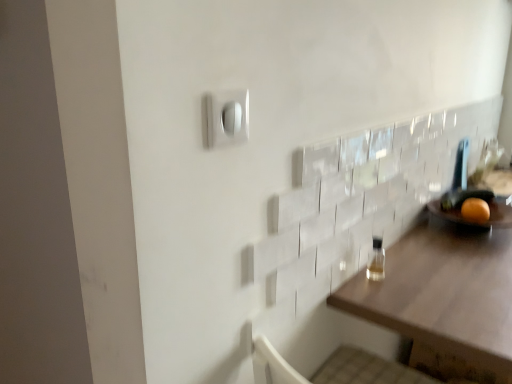
Based on the photo, measure the distance between point (243, 103) and camera.

26.02 inches.

This screenshot has height=384, width=512. What do you see at coordinates (376, 260) in the screenshot? I see `clear glass bottle at right` at bounding box center [376, 260].

What do you see at coordinates (444, 297) in the screenshot? I see `brown wooden table at right` at bounding box center [444, 297].

The image size is (512, 384). I want to click on white plastic light switch at upper center, so click(227, 117).

In the image, is white plastic light switch at upper center on the left side or the right side of clear glass bottle at right?

From the image, it's evident that white plastic light switch at upper center is to the left of clear glass bottle at right.

At what (x,y) coordinates should I click in order to perform the action: click on light switch above the clear glass bottle at right (from the image's perspective). Please return your answer as a coordinate pair (x, y). Image resolution: width=512 pixels, height=384 pixels. Looking at the image, I should click on (227, 117).

In terms of size, does white plastic light switch at upper center appear bigger or smaller than clear glass bottle at right?

white plastic light switch at upper center is smaller than clear glass bottle at right.

Is point (244, 120) positioned after point (368, 258)?

That is False.

Which object is thinner, orange matte at right or white plastic light switch at upper center?

white plastic light switch at upper center is thinner.

Considering their positions, is orange matte at right located in front of or behind white plastic light switch at upper center?

orange matte at right is behind white plastic light switch at upper center.

In terms of height, does orange matte at right look taller or shorter compared to white plastic light switch at upper center?

Considering their sizes, orange matte at right has less height than white plastic light switch at upper center.

Which object is positioned more to the left, orange matte at right or white plastic light switch at upper center?

white plastic light switch at upper center.

Does white plastic light switch at upper center have a smaller size compared to brown wooden table at right?

Indeed, white plastic light switch at upper center has a smaller size compared to brown wooden table at right.

Which point is more distant from viewer, (208, 145) or (465, 351)?

The point (465, 351) is farther from the camera.

Which is in front, white plastic light switch at upper center or brown wooden table at right?

white plastic light switch at upper center is more forward.

From the image's perspective, which is below, white plastic light switch at upper center or brown wooden table at right?

brown wooden table at right is shown below in the image.

From a real-world perspective, does brown wooden table at right sit lower than white plastic light switch at upper center?

Correct, in the physical world, brown wooden table at right is lower than white plastic light switch at upper center.

Considering the relative sizes of brown wooden table at right and white plastic light switch at upper center in the image provided, is brown wooden table at right thinner than white plastic light switch at upper center?

No, brown wooden table at right is not thinner than white plastic light switch at upper center.

Is brown wooden table at right taller or shorter than white plastic light switch at upper center?

Considering their sizes, brown wooden table at right has more height than white plastic light switch at upper center.

Between brown wooden table at right and white plastic light switch at upper center, which one appears on the right side from the viewer's perspective?

From the viewer's perspective, brown wooden table at right appears more on the right side.

Which is closer, (x=462, y=215) or (x=373, y=278)?

The point (x=373, y=278) is closer to the camera.

Is orange matte at right oriented away from clear glass bottle at right?

No.

Is orange matte at right to the right of clear glass bottle at right from the viewer's perspective?

Correct, you'll find orange matte at right to the right of clear glass bottle at right.

Locate an element on the screen. The width and height of the screenshot is (512, 384). orange located behind the clear glass bottle at right is located at coordinates (475, 210).

Is brown wooden table at right at the back of clear glass bottle at right?

clear glass bottle at right does not have its back to brown wooden table at right.

Visually, is clear glass bottle at right positioned to the left or to the right of brown wooden table at right?

Based on their positions, clear glass bottle at right is located to the left of brown wooden table at right.

Which of these two, clear glass bottle at right or brown wooden table at right, is smaller?

With smaller size is clear glass bottle at right.

Is clear glass bottle at right positioned with its back to orange matte at right?

No, clear glass bottle at right's orientation is not away from orange matte at right.

Considering the points (375, 253) and (470, 208), which point is in front, point (375, 253) or point (470, 208)?

Positioned in front is point (375, 253).

From the image's perspective, which is above, clear glass bottle at right or orange matte at right?

orange matte at right.

Is clear glass bottle at right far away from orange matte at right?

No, clear glass bottle at right is not far from orange matte at right.

The height and width of the screenshot is (384, 512). There is a clear glass bottle at right. Find the location of `light switch above it (from a real-world perspective)`. light switch above it (from a real-world perspective) is located at coordinates (227, 117).

Locate an element on the screen. The image size is (512, 384). light switch on the left of orange matte at right is located at coordinates (227, 117).

Which object lies nearer to the anchor point orange matte at right, clear glass bottle at right or white plastic light switch at upper center?

clear glass bottle at right is closer to orange matte at right.

Estimate the real-world distances between objects in this image. Which object is further from white plastic light switch at upper center, brown wooden table at right or orange matte at right?

The object further to white plastic light switch at upper center is orange matte at right.

When comparing their distances from white plastic light switch at upper center, does clear glass bottle at right or orange matte at right seem further?

The object further to white plastic light switch at upper center is orange matte at right.

Based on their spatial positions, is white plastic light switch at upper center or orange matte at right closer to brown wooden table at right?

Among the two, orange matte at right is located nearer to brown wooden table at right.

From the image, which object appears to be nearer to brown wooden table at right, white plastic light switch at upper center or clear glass bottle at right?

The object closer to brown wooden table at right is clear glass bottle at right.

Considering their positions, is orange matte at right positioned further to clear glass bottle at right than brown wooden table at right?

orange matte at right.

Based on their spatial positions, is clear glass bottle at right or orange matte at right further from brown wooden table at right?

orange matte at right lies further to brown wooden table at right than the other object.

From the image, which object appears to be farther from clear glass bottle at right, white plastic light switch at upper center or brown wooden table at right?

The object further to clear glass bottle at right is white plastic light switch at upper center.

In order to click on bottle located between brown wooden table at right and orange matte at right in the depth direction in this screenshot , I will do `click(376, 260)`.

I want to click on bottle situated between white plastic light switch at upper center and brown wooden table at right from left to right, so click(376, 260).

The width and height of the screenshot is (512, 384). In order to click on orange between white plastic light switch at upper center and brown wooden table at right in the horizontal direction in this screenshot , I will do `click(475, 210)`.

Identify the location of bottle situated between white plastic light switch at upper center and orange matte at right from left to right. The width and height of the screenshot is (512, 384). (376, 260).